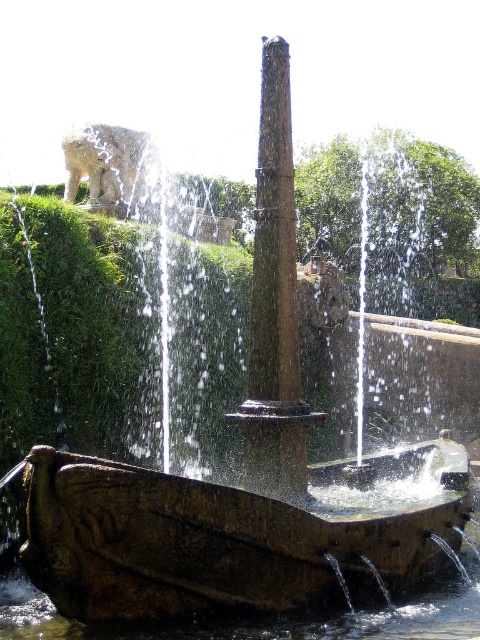
Question: Is rusty stone boat at center to the right of brown stone pillar at center from the viewer's perspective?

Choices:
 (A) no
 (B) yes

Answer: (B)

Question: Is rusty stone boat at center to the right of brown stone pillar at center from the viewer's perspective?

Choices:
 (A) no
 (B) yes

Answer: (B)

Question: Can you confirm if rusty stone boat at center is positioned to the right of brown stone pillar at center?

Choices:
 (A) yes
 (B) no

Answer: (A)

Question: Which object appears closest to the camera in this image?

Choices:
 (A) brown stone pillar at center
 (B) rusty stone boat at center

Answer: (B)

Question: Which point is closer to the camera taking this photo?

Choices:
 (A) (141, 528)
 (B) (265, 321)

Answer: (A)

Question: Which point appears farthest from the camera in this image?

Choices:
 (A) (259, 193)
 (B) (132, 609)

Answer: (A)